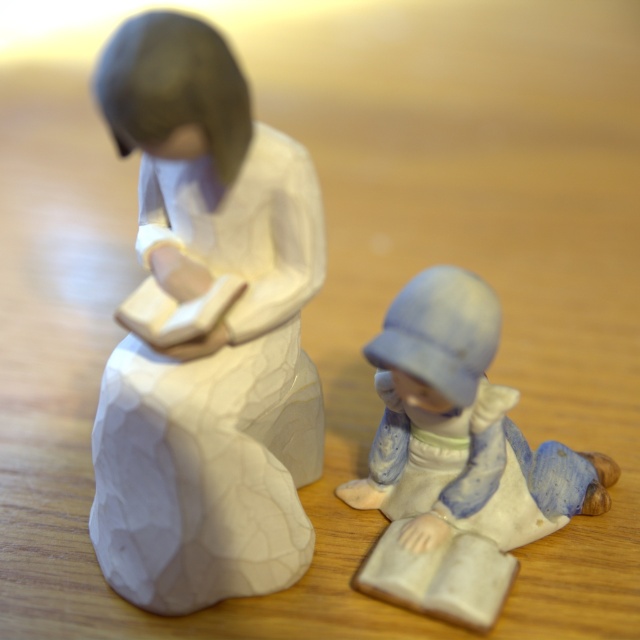
Does white glossy statue at left have a smaller size compared to porcelain figure at lower right?

No.

Between white glossy statue at left and porcelain figure at lower right, which one has more height?

white glossy statue at left

Is point (186, 593) positioned behind point (403, 552)?

No, (186, 593) is in front of (403, 552).

This screenshot has height=640, width=640. I want to click on white glossy statue at left, so click(205, 333).